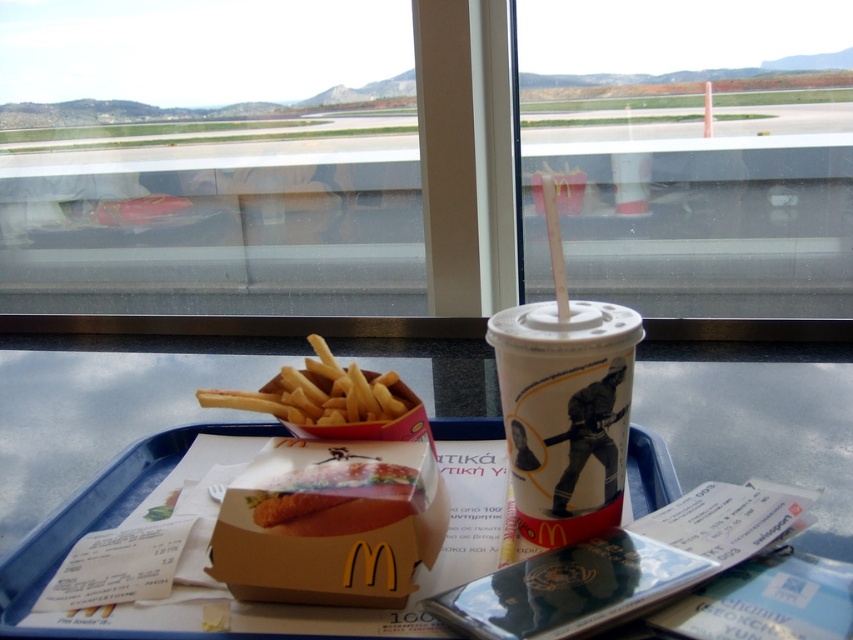
Who is positioned more to the left, transparent plastic cup at center or golden crispy french fries at center?

Positioned to the left is golden crispy french fries at center.

Find the location of a particular element. The width and height of the screenshot is (853, 640). transparent plastic cup at center is located at coordinates (692, 160).

Between cardboard box at center and golden crispy french fries at center, which one appears on the left side from the viewer's perspective?

From the viewer's perspective, golden crispy french fries at center appears more on the left side.

Find the location of a particular element. The image size is (853, 640). cardboard box at center is located at coordinates (329, 524).

Is the position of blue plastic tray at center less distant than that of cardboard box at center?

No, it is not.

Is blue plastic tray at center to the right of cardboard box at center from the viewer's perspective?

No, blue plastic tray at center is not to the right of cardboard box at center.

Image resolution: width=853 pixels, height=640 pixels. What are the coordinates of `blue plastic tray at center` in the screenshot? It's located at (103, 406).